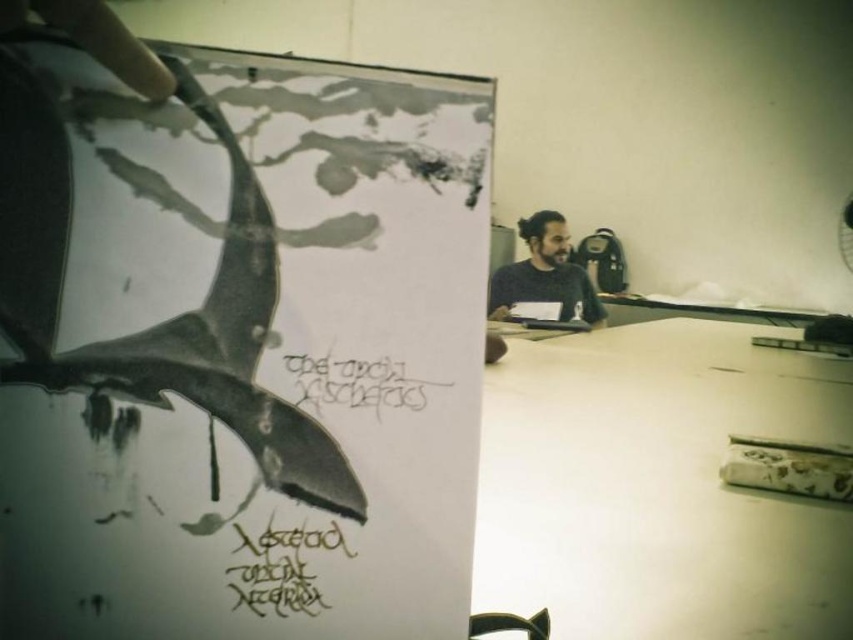
You are taking a photo of the artwork displayed in the workspace. The artwork is held by someone at point (221, 616). If your camera has a focal length of 50mm and you want to ensure the artwork is in focus, what distance should you set your camera to focus at?

The point (221, 616) is 31.08 centimeters from the camera, so you should set your camera to focus at 31.08 centimeters to ensure the artwork is in focus.